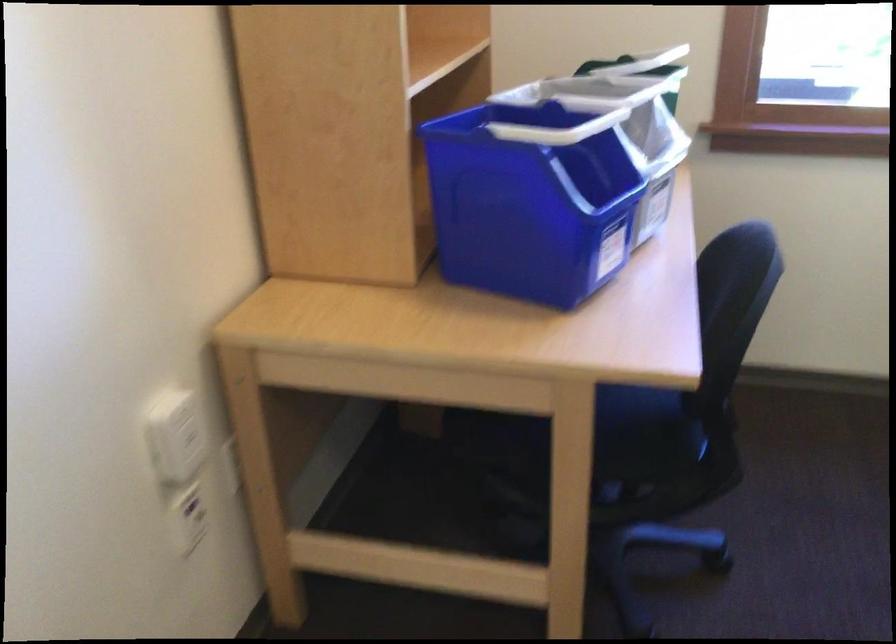
Which object does [174,435] point to?

It corresponds to the white wall plug in the image.